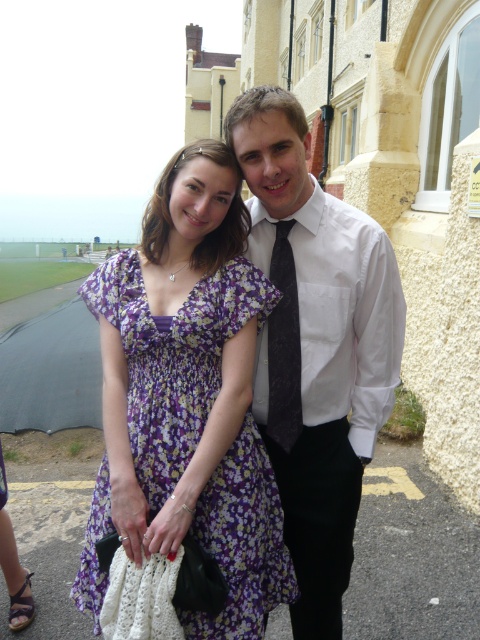
Question: Which point is farther from the camera taking this photo?

Choices:
 (A) (288, 369)
 (B) (393, 333)

Answer: (B)

Question: Does white smooth shirt at center have a larger size compared to dark gray textured tie at center?

Choices:
 (A) no
 (B) yes

Answer: (B)

Question: Estimate the real-world distances between objects in this image. Which object is closer to the dark gray textured tie at center?

Choices:
 (A) floral fabric dress at center
 (B) white smooth shirt at center

Answer: (B)

Question: Which point is closer to the camera?

Choices:
 (A) white smooth shirt at center
 (B) floral fabric dress at center
 (C) dark gray textured tie at center

Answer: (B)

Question: Is white smooth shirt at center wider than floral fabric dress at center?

Choices:
 (A) yes
 (B) no

Answer: (B)

Question: Is white smooth shirt at center closer to camera compared to floral fabric dress at center?

Choices:
 (A) yes
 (B) no

Answer: (B)